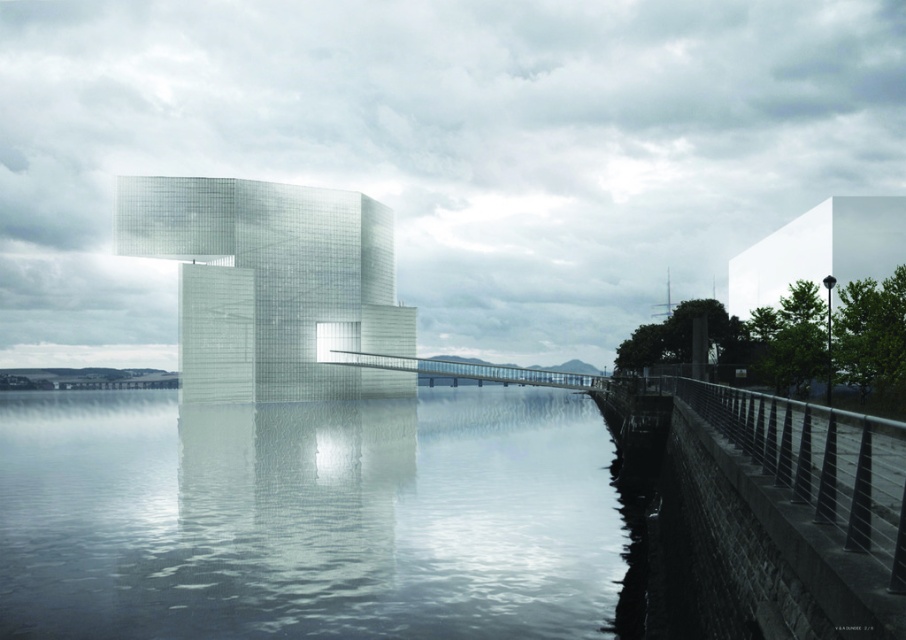
You are an architect visiting the site and need to cross from the shore to the building. You see the transparent glass water at lower center and the transparent glass bridge at center. Which path would allow you to walk safely without getting wet?

The transparent glass bridge at center is the safe path to walk on without getting wet, as the transparent glass water at lower center is likely the actual water body where walking would result in getting wet.

You are standing in front of the modern architectural structure and want to place a small decorative object on the transparent glass water at lower center. According to the coordinates provided, where exactly should you place it?

The transparent glass water at lower center should be placed at the coordinates point (310,518) as specified in the description.

You are standing at the point marked as point (310, 518) in the image. What object is located exactly at that point?

The object at point (310, 518) is transparent glass water at lower center.